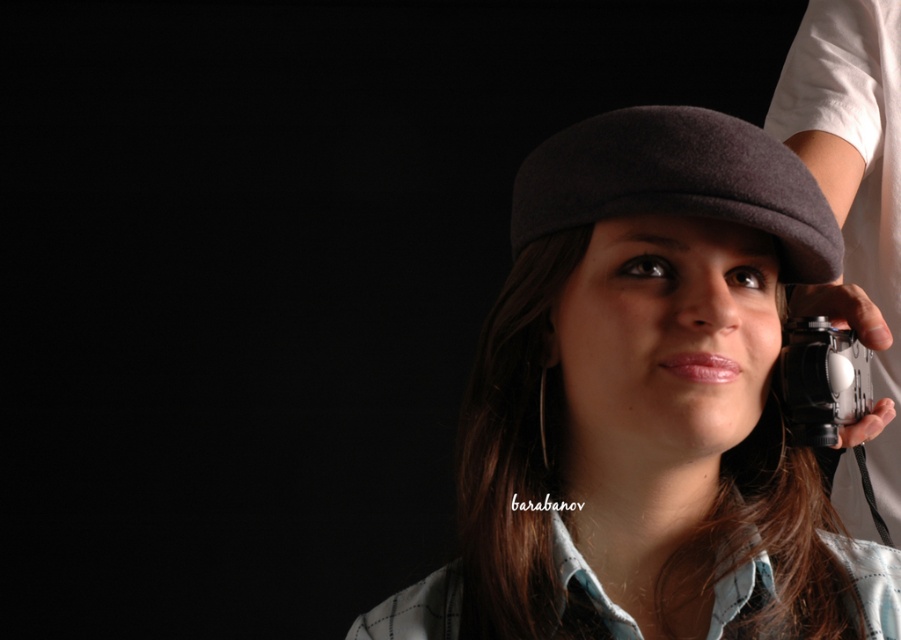
The height and width of the screenshot is (640, 901). What are the coordinates of `matte gray beret at center` in the screenshot? It's located at (645, 404).

Between point (653, 384) and point (790, 156), which one is positioned in front?

Point (653, 384) is more forward.

Find the location of a particular element. Image resolution: width=901 pixels, height=640 pixels. matte gray beret at center is located at coordinates (645, 404).

Does matte gray beret at center appear under black matte camera at right?

Indeed, matte gray beret at center is positioned under black matte camera at right.

Is matte gray beret at center shorter than black matte camera at right?

Correct, matte gray beret at center is not as tall as black matte camera at right.

Does point (516, 621) come behind point (889, 321)?

No, it is not.

You are a GUI agent. You are given a task and a screenshot of the screen. Output one action in this format:
    pyautogui.click(x=<x>, y=<y>)
    Task: Click on the matte gray beret at center
    The image size is (901, 640).
    Given the screenshot: What is the action you would take?
    pyautogui.click(x=645, y=404)

Can you confirm if dark woolen hat at center is bigger than black plastic camera at right?

Yes.

Is dark woolen hat at center smaller than black plastic camera at right?

Incorrect, dark woolen hat at center is not smaller in size than black plastic camera at right.

Between point (719, 124) and point (824, 368), which one is positioned in front?

Point (719, 124) is more forward.

I want to click on dark woolen hat at center, so click(677, 182).